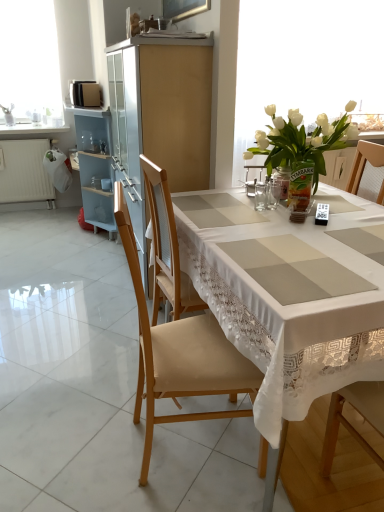
Identify the location of free spot in front of matte wood cabinet at center. The width and height of the screenshot is (384, 512). (86, 330).